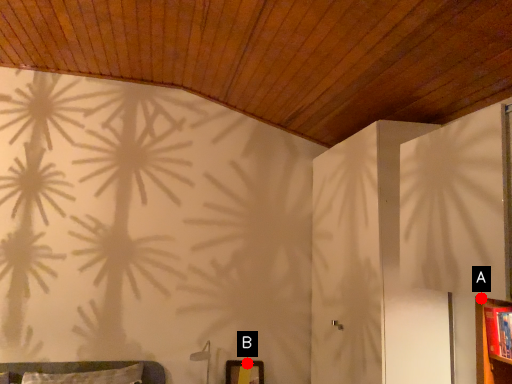
Question: Two points are circled on the image, labeled by A and B beside each circle. Which point is closer to the camera taking this photo?

Choices:
 (A) A is closer
 (B) B is closer

Answer: (A)